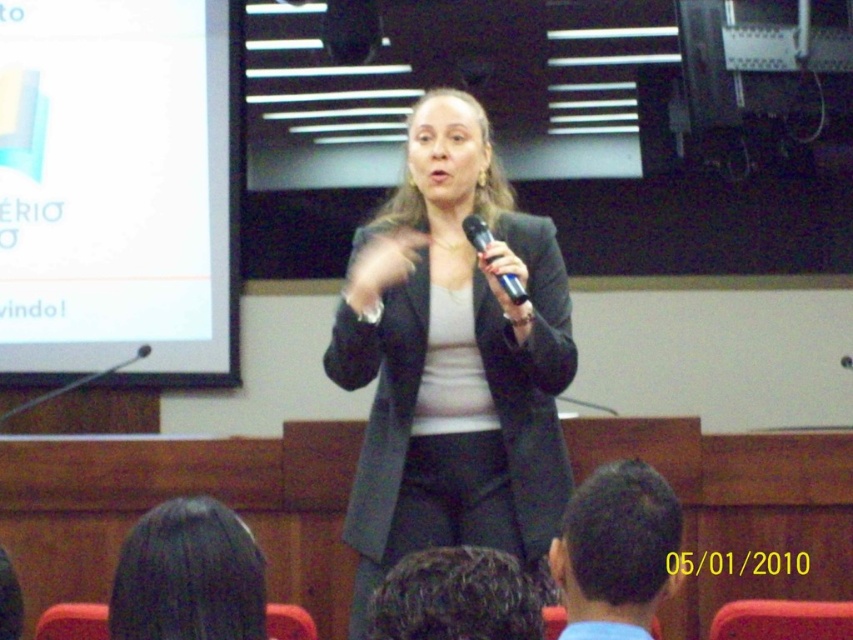
Who is more forward, (15,579) or (467,218)?

Point (15,579)

Between dark brown leather chair at lower left and black metallic microphone at center, which one is positioned lower?

dark brown leather chair at lower left is lower down.

Where is `dark brown leather chair at lower left`? This screenshot has height=640, width=853. dark brown leather chair at lower left is located at coordinates (9, 600).

Is blue fabric head at lower center to the right of dark brown leather chair at lower left from the viewer's perspective?

Correct, you'll find blue fabric head at lower center to the right of dark brown leather chair at lower left.

Image resolution: width=853 pixels, height=640 pixels. Describe the element at coordinates (616, 548) in the screenshot. I see `blue fabric head at lower center` at that location.

At what (x,y) coordinates should I click in order to perform the action: click on blue fabric head at lower center. Please return your answer as a coordinate pair (x, y). This screenshot has width=853, height=640. Looking at the image, I should click on (616, 548).

Which is above, dark hair at lower left or blue fabric head at lower center?

Positioned higher is dark hair at lower left.

Does dark hair at lower left appear under blue fabric head at lower center?

No, dark hair at lower left is not below blue fabric head at lower center.

Who is more distant from viewer, (132, 536) or (604, 611)?

The point (604, 611) is behind.

In order to click on dark hair at lower left in this screenshot , I will do `click(189, 576)`.